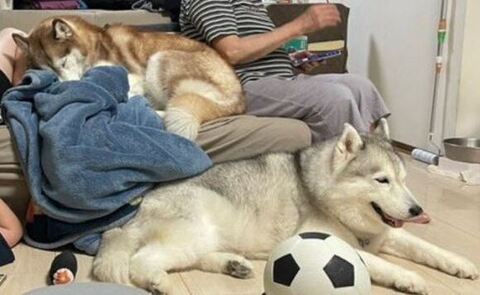
This screenshot has height=295, width=480. What are the coordinates of `couch` in the screenshot? It's located at (279, 135).